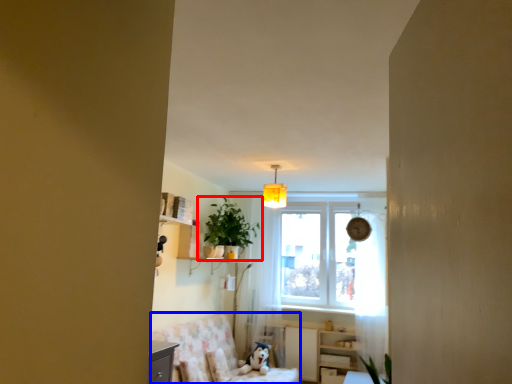
Question: Which object appears closest to the camera in this image, houseplant (highlighted by a red box) or swivel chair (highlighted by a blue box)?

Choices:
 (A) houseplant
 (B) swivel chair

Answer: (B)